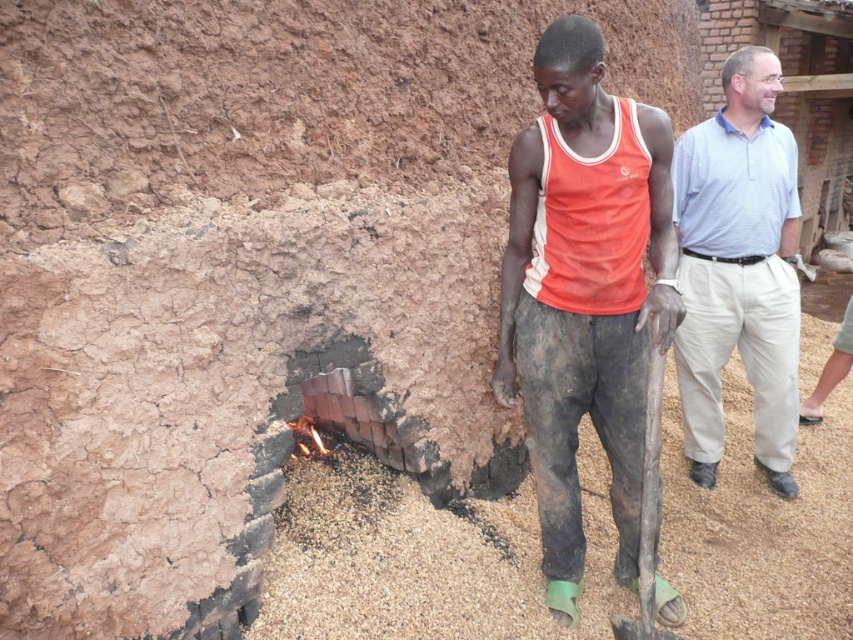
Based on the photo, you are standing in the outdoor scene and want to hand a tool to both the person wearing the matte orange tank top at center and the light blue striped shirt at right. Which person should you approach first to ensure you can reach them without moving closer?

You should approach the matte orange tank top at center first because it is closer to you than the light blue striped shirt at right, so you can reach them without needing to move closer.

Based on the photo, you are standing in front of the clay wall and want to touch both points on the wall. Which point will you reach first, point (747, 257) or point (735, 228)?

Point (735, 228) will be reached first because it is closer to you than point (747, 257), which is further away.

You are standing at the origin point of the coordinate system in the image. You want to move towards the matte orange tank top at center. What direction should you move in?

Since the matte orange tank top at center is located at coordinate point 0.456 on the x axis and 0.686 on the y axis, you should move northeast to reach it.